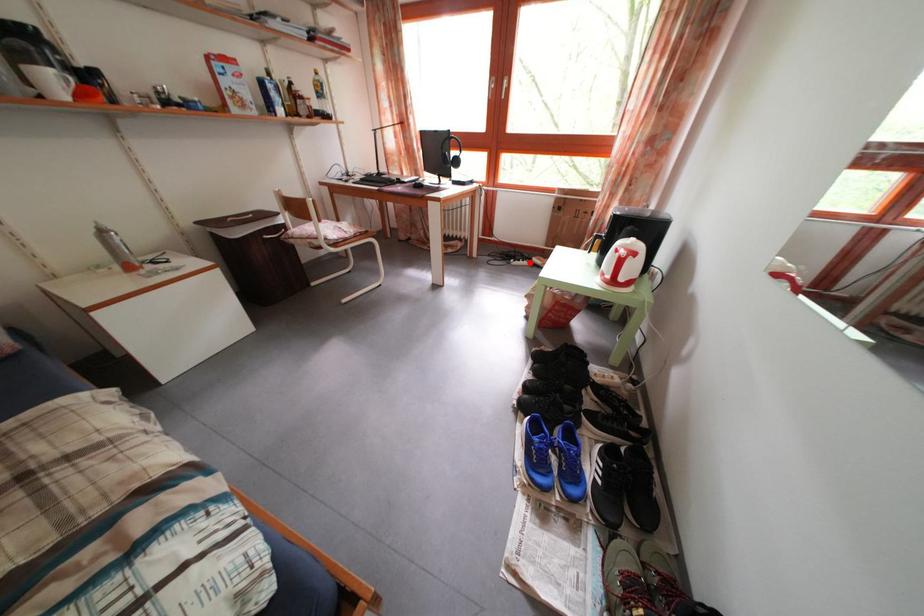
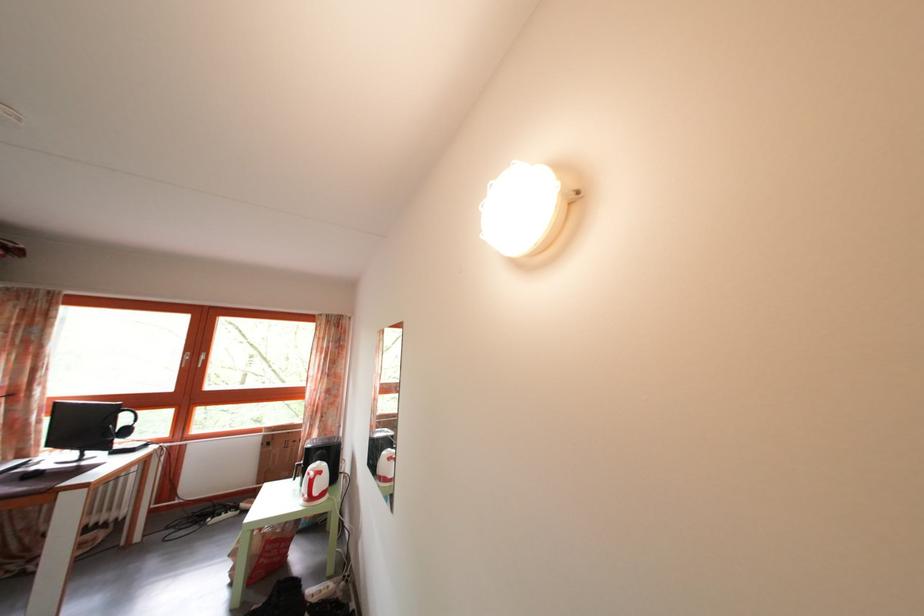
In the second image, find the point that corresponds to the highlighted location in the first image.

(233, 514)